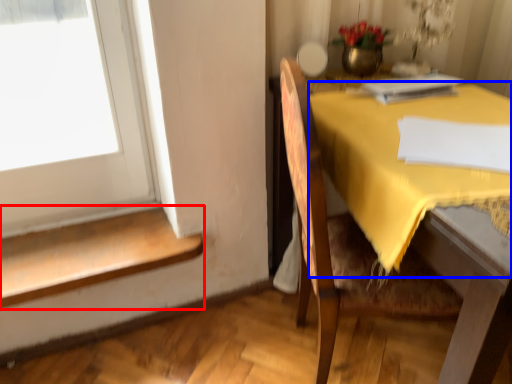
Question: Which point is closer to the camera, stairwell (highlighted by a red box) or tablecloth (highlighted by a blue box)?

Choices:
 (A) stairwell
 (B) tablecloth

Answer: (B)